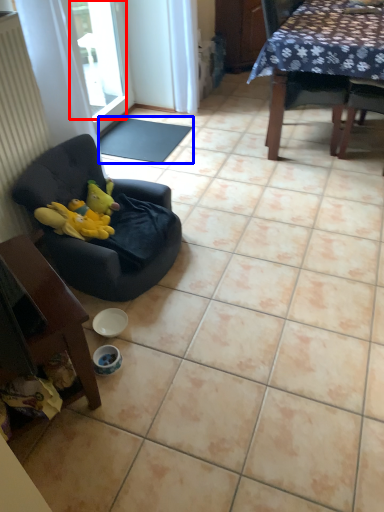
Question: Which object appears closest to the camera in this image, window screen (highlighted by a red box) or mat (highlighted by a blue box)?

Choices:
 (A) window screen
 (B) mat

Answer: (A)